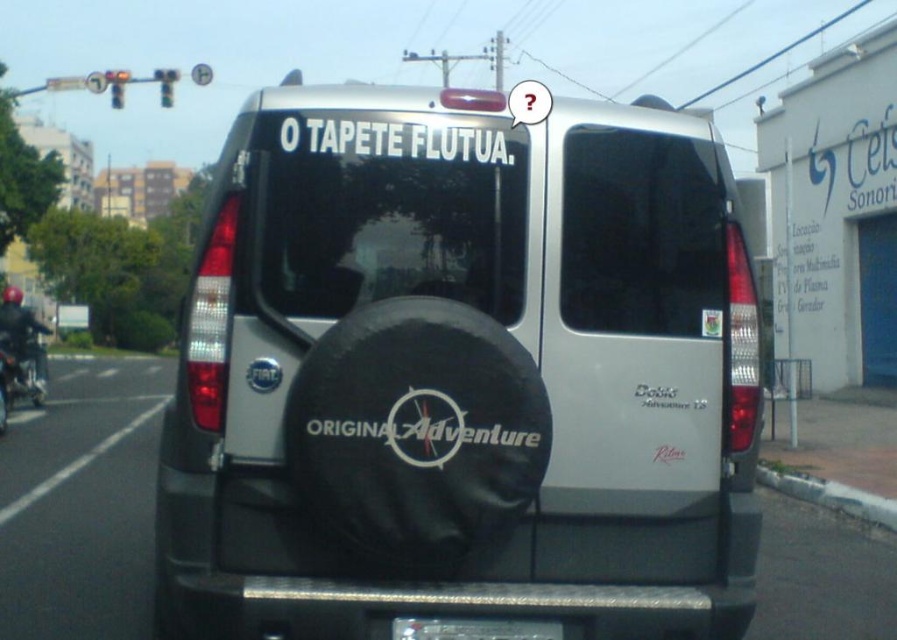
Question: Is white plastic license plate at center to the left of black leather helmet at left from the viewer's perspective?

Choices:
 (A) yes
 (B) no

Answer: (B)

Question: Among these points, which one is nearest to the camera?

Choices:
 (A) (27, 344)
 (B) (166, 93)
 (C) (440, 625)

Answer: (C)

Question: Which object is closer to the camera taking this photo?

Choices:
 (A) white plastic license plate at center
 (B) metallic silver traffic light at upper center
 (C) metallic red traffic light at upper center

Answer: (A)

Question: Can you confirm if silver matte spare tire at center is wider than black leather helmet at left?

Choices:
 (A) yes
 (B) no

Answer: (B)

Question: Which object appears farthest from the camera in this image?

Choices:
 (A) silver matte spare tire at center
 (B) white matte sticker at center
 (C) white plastic license plate at center
 (D) black leather helmet at left

Answer: (D)

Question: Is silver matte spare tire at center behind metallic red traffic light at upper center?

Choices:
 (A) no
 (B) yes

Answer: (A)